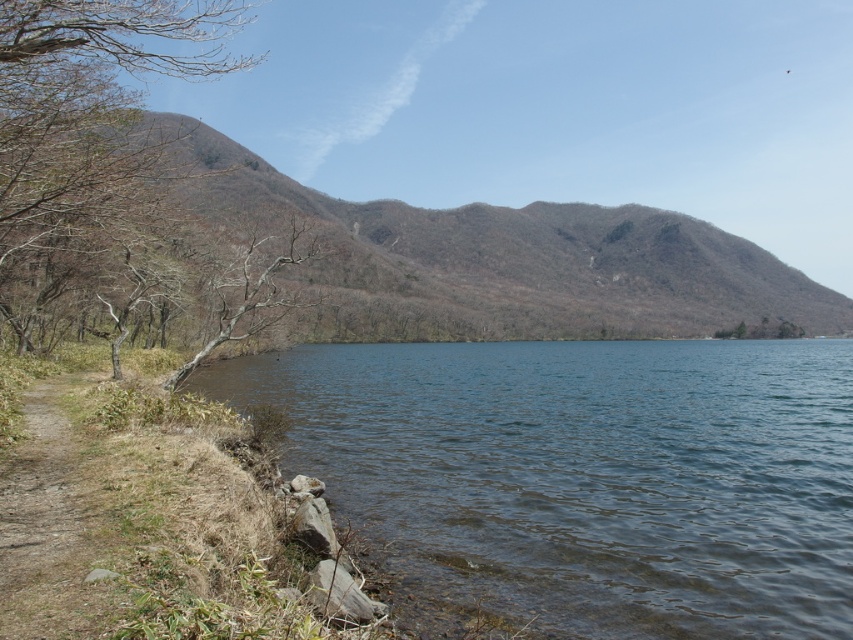
You are standing at the brown dirt path at lower left and want to reach the brown textured mountain at center. Which direction should you head towards?

You should head towards the right direction since the brown textured mountain at center is located to the right of the brown dirt path at lower left.

You are a hiker who wants to take a photo of the brown textured mountain at center. Based on the scene, where should you position yourself to capture the entire mountain in the frame?

The brown textured mountain at center is located at coordinates point (492, 259), so you should position yourself at the center of the scene to capture the entire mountain in the frame.